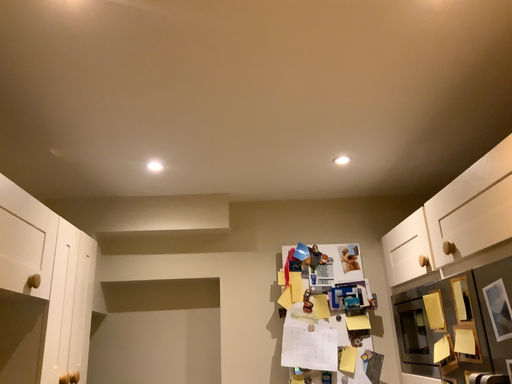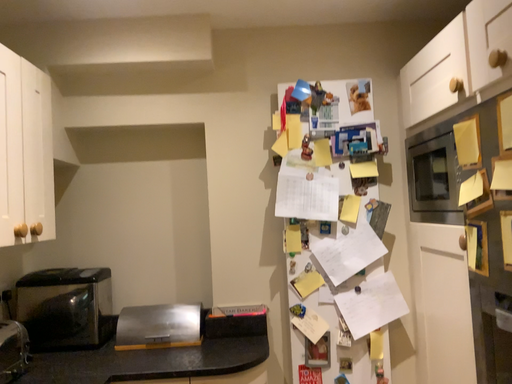
Question: How did the camera likely rotate when shooting the video?

Choices:
 (A) rotated downward
 (B) rotated upward

Answer: (A)